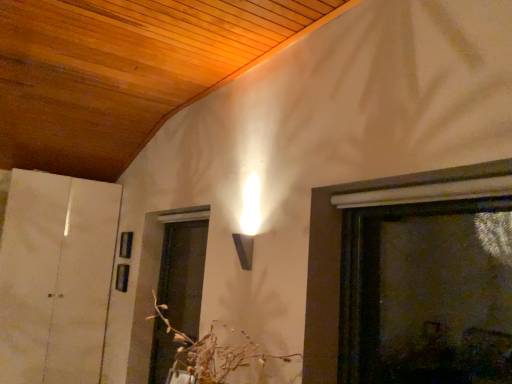
Question: From a real-world perspective, is translucent glass screen door at lower center over white paper at left?

Choices:
 (A) no
 (B) yes

Answer: (A)

Question: Is translucent glass screen door at lower center closer to the viewer compared to white paper at left?

Choices:
 (A) yes
 (B) no

Answer: (A)

Question: Is translucent glass screen door at lower center bigger than white paper at left?

Choices:
 (A) yes
 (B) no

Answer: (B)

Question: Are translucent glass screen door at lower center and white paper at left located far from each other?

Choices:
 (A) yes
 (B) no

Answer: (A)

Question: Could you tell me if translucent glass screen door at lower center is turned towards white paper at left?

Choices:
 (A) yes
 (B) no

Answer: (B)

Question: Considering the positions of point (184, 332) and point (237, 357), is point (184, 332) closer or farther from the camera than point (237, 357)?

Choices:
 (A) farther
 (B) closer

Answer: (A)

Question: Based on their positions, is translucent glass screen door at lower center located to the left or right of brown textured floral arrangement at center?

Choices:
 (A) right
 (B) left

Answer: (B)

Question: Is translucent glass screen door at lower center in front of or behind brown textured floral arrangement at center in the image?

Choices:
 (A) behind
 (B) front

Answer: (A)

Question: Based on their sizes in the image, would you say translucent glass screen door at lower center is bigger or smaller than brown textured floral arrangement at center?

Choices:
 (A) big
 (B) small

Answer: (B)

Question: From a real-world perspective, is brown textured floral arrangement at center above or below translucent glass screen door at lower center?

Choices:
 (A) below
 (B) above

Answer: (A)

Question: Is brown textured floral arrangement at center spatially inside translucent glass screen door at lower center, or outside of it?

Choices:
 (A) inside
 (B) outside

Answer: (B)

Question: From the image's perspective, is brown textured floral arrangement at center above or below translucent glass screen door at lower center?

Choices:
 (A) above
 (B) below

Answer: (A)

Question: Relative to translucent glass screen door at lower center, is brown textured floral arrangement at center in front or behind?

Choices:
 (A) front
 (B) behind

Answer: (A)

Question: Is white paper at left wider or thinner than translucent glass screen door at lower center?

Choices:
 (A) thin
 (B) wide

Answer: (B)

Question: From the image's perspective, is white paper at left positioned above or below translucent glass screen door at lower center?

Choices:
 (A) above
 (B) below

Answer: (A)